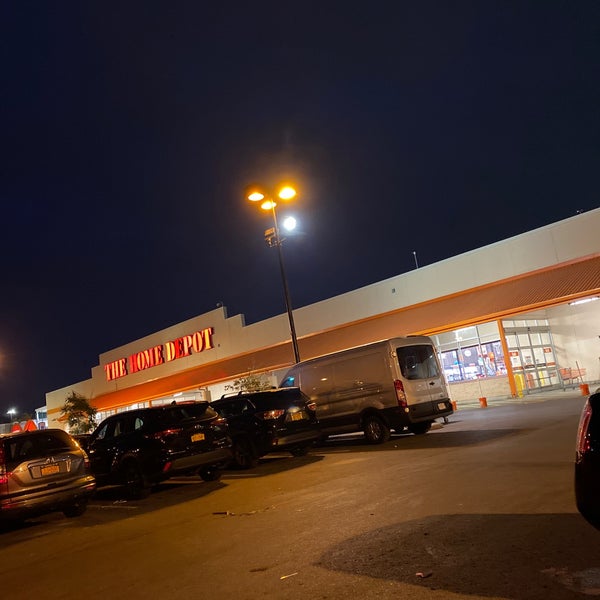
At what (x,y) coordinates should I click in order to perform the action: click on 2 sliding doors. Please return your answer as a coordinate pair (x, y). Looking at the image, I should click on (537, 359).